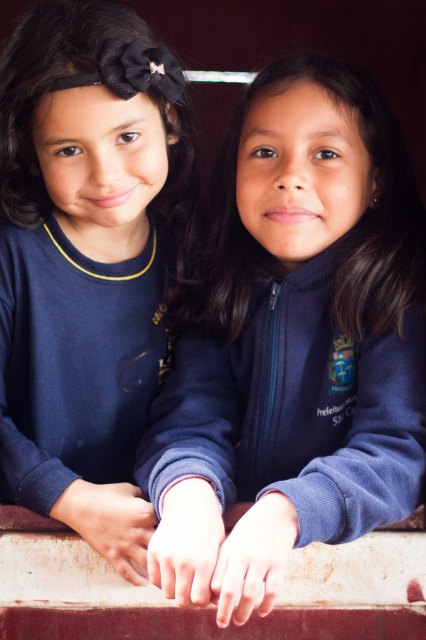
Question: Can you confirm if matte blue sweatshirt at center is wider than navy blue sweatshirt at left?

Choices:
 (A) no
 (B) yes

Answer: (B)

Question: Which point is farther to the camera?

Choices:
 (A) navy blue sweatshirt at left
 (B) matte blue sweatshirt at center

Answer: (A)

Question: Among these objects, which one is farthest from the camera?

Choices:
 (A) matte blue sweatshirt at center
 (B) navy blue sweatshirt at left

Answer: (B)

Question: Does matte blue sweatshirt at center have a smaller size compared to navy blue sweatshirt at left?

Choices:
 (A) yes
 (B) no

Answer: (B)

Question: Is matte blue sweatshirt at center positioned in front of navy blue sweatshirt at left?

Choices:
 (A) yes
 (B) no

Answer: (A)